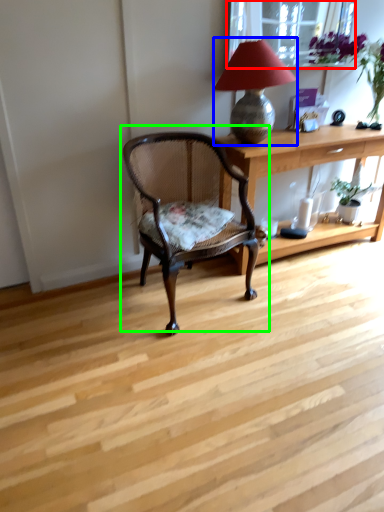
Question: Based on their relative distances, which object is farther from window screen (highlighted by a red box)? Choose from lamp (highlighted by a blue box) and chair (highlighted by a green box).

Choices:
 (A) lamp
 (B) chair

Answer: (B)